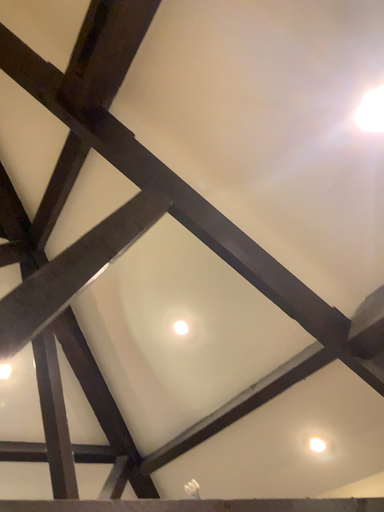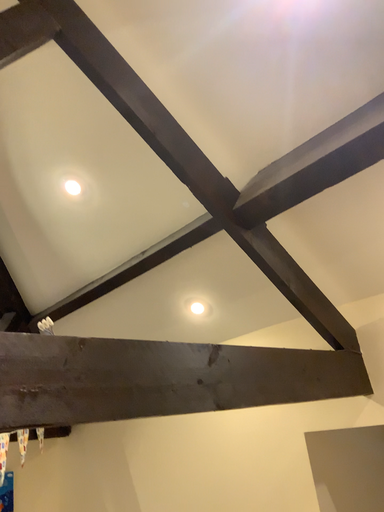
Question: Which way did the camera rotate in the video?

Choices:
 (A) rotated left
 (B) rotated right

Answer: (B)